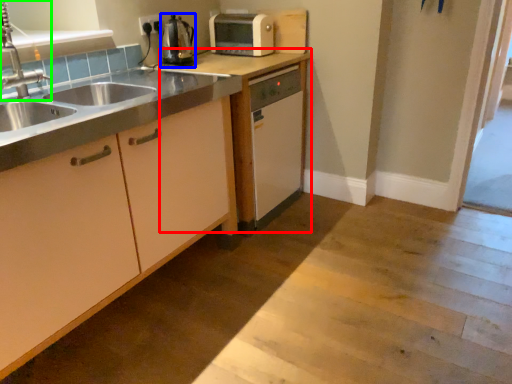
Question: Which object is the farthest from cabinetry (highlighted by a red box)? Choose among these: kitchen appliance (highlighted by a blue box) or tap (highlighted by a green box).

Choices:
 (A) kitchen appliance
 (B) tap

Answer: (B)